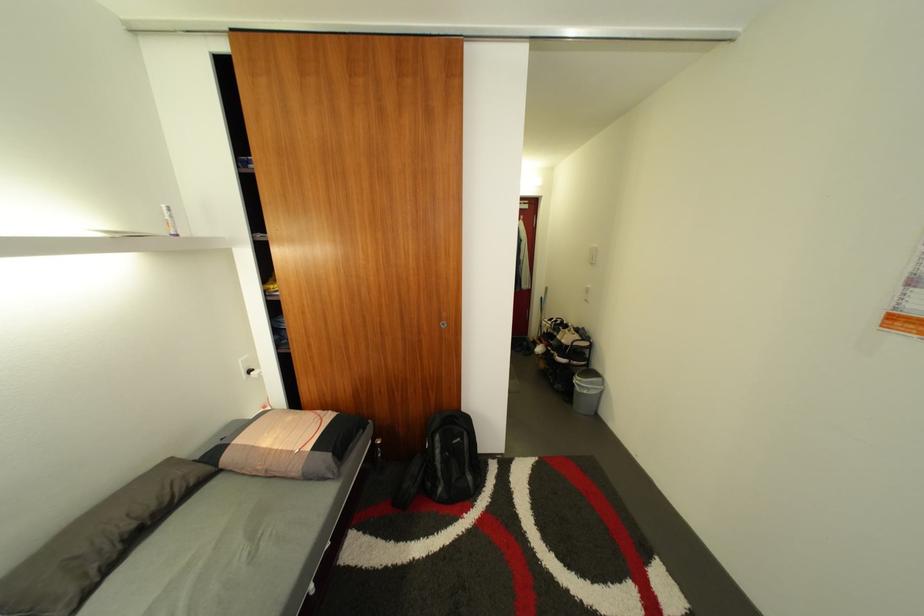
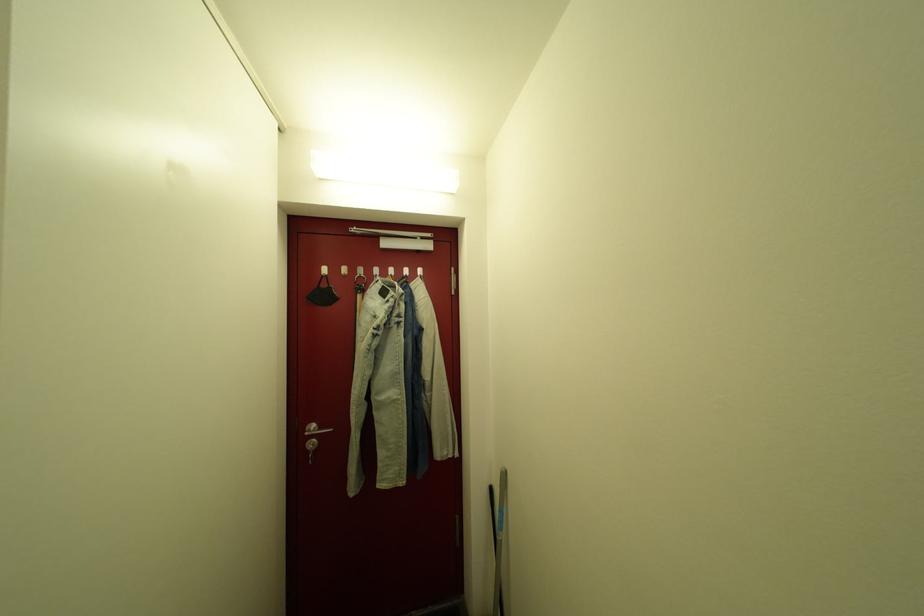
Question: In a continuous first-person perspective shot, in which direction is the camera moving?

Choices:
 (A) Left
 (B) Right
 (C) Forward
 (D) Backward

Answer: (C)